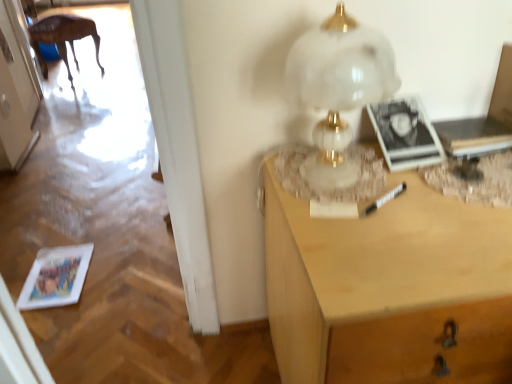
Find the location of a particular element. vacant space in matte paper magazine at lower left (from a real-world perspective) is located at coordinates (54, 273).